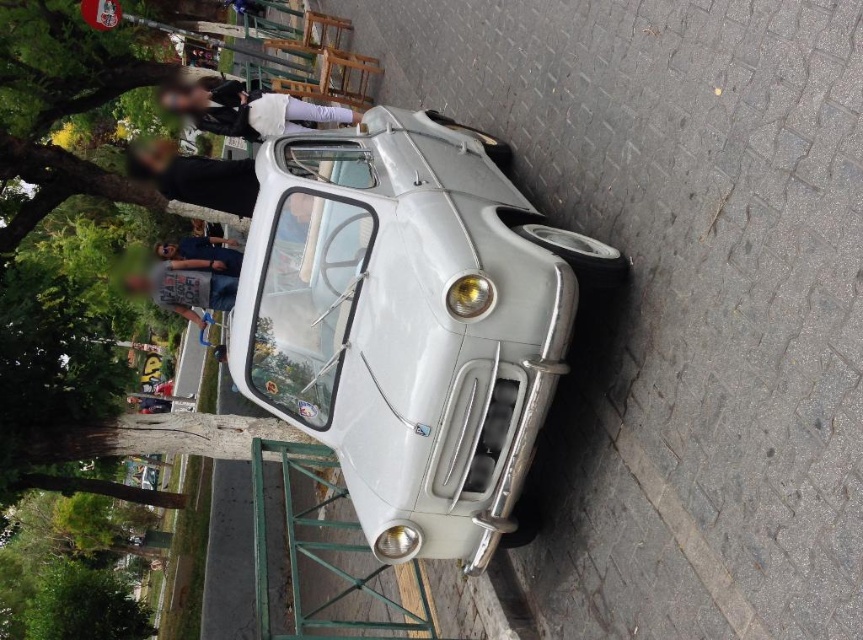
Question: Is white metallic car at center further to camera compared to brushed metal shirt at center?

Choices:
 (A) yes
 (B) no

Answer: (B)

Question: Is white metallic car at center closer to the viewer compared to brushed metal shirt at center?

Choices:
 (A) yes
 (B) no

Answer: (A)

Question: Can you confirm if brushed metal shirt at center is positioned to the left of matte black t-shirt at center?

Choices:
 (A) no
 (B) yes

Answer: (B)

Question: Among these points, which one is nearest to the camera?

Choices:
 (A) (184, 246)
 (B) (265, 225)
 (C) (194, 320)
 (D) (243, 138)

Answer: (B)

Question: Which object appears farthest from the camera in this image?

Choices:
 (A) white metallic car at center
 (B) matte black t-shirt at center
 (C) brushed metal shirt at center

Answer: (B)

Question: Among these objects, which one is farthest from the camera?

Choices:
 (A) white metallic car at center
 (B) white fabric shirt at upper center

Answer: (B)